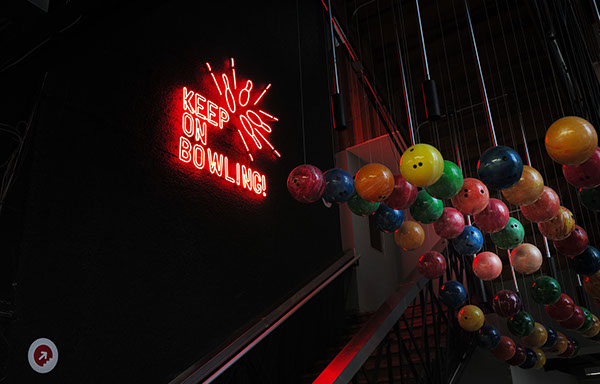
Where is `rods`? Image resolution: width=600 pixels, height=384 pixels. rods is located at coordinates (493, 131), (411, 123).